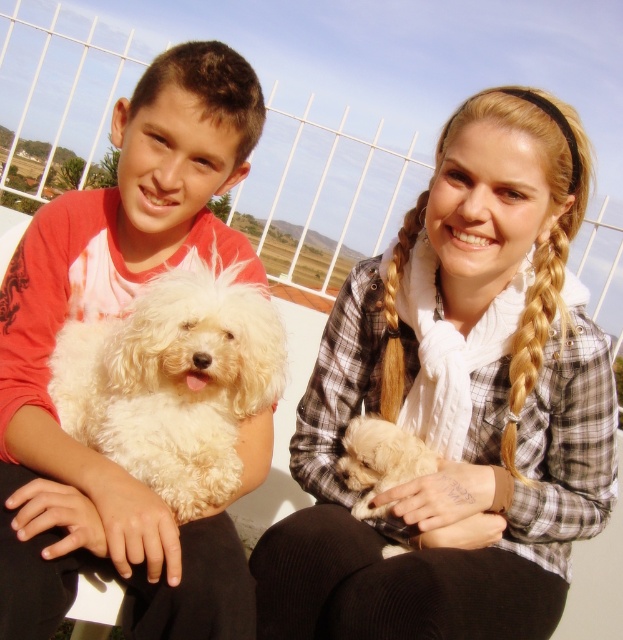
Question: Can you confirm if fluffy white dog at left is positioned to the left of white fluffy dog at left?

Choices:
 (A) no
 (B) yes

Answer: (B)

Question: Which of the following is the farthest from the observer?

Choices:
 (A) blonde braided hair at upper right
 (B) white fluffy dog at left
 (C) golden braided hair at upper right
 (D) fluffy white dog at left

Answer: (C)

Question: Which point is closer to the camera?

Choices:
 (A) golden braided hair at upper right
 (B) blonde braided hair at upper right

Answer: (B)

Question: Which of the following is the closest to the observer?

Choices:
 (A) plaid shirt at center
 (B) blonde braided hair at upper right
 (C) white fluffy dog at left
 (D) golden braided hair at upper right

Answer: (A)

Question: Is fluffy white dog at left above white fluffy dog at left?

Choices:
 (A) yes
 (B) no

Answer: (A)

Question: Can you confirm if white fluffy dog at left is wider than golden braided hair at upper right?

Choices:
 (A) no
 (B) yes

Answer: (B)